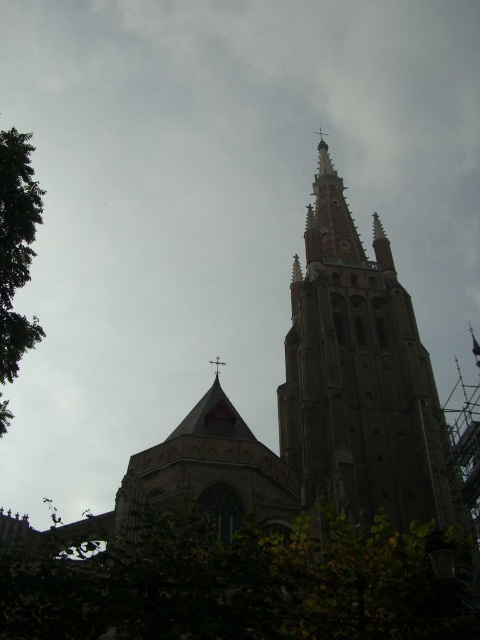
You are a landscape architect planning to install a walkway between the green leafy tree at lower center and the green leafy tree at left. What is the minimum length of the walkway required to connect both trees?

The minimum length of the walkway required to connect the green leafy tree at lower center and the green leafy tree at left is 78.92 feet, as they are 78.92 feet apart from each other.

You are standing in front of the Gothic church and notice two green leafy trees. Which tree, the green leafy tree at lower center or the green leafy tree at left, is located to the right of the other?

The green leafy tree at lower center is positioned on the right side of the green leafy tree at left.

You are standing at the entrance of the grand Gothic church and want to locate the bell tower. According to the image, where exactly is the brown stone tower at center located in terms of coordinates?

The brown stone tower at center is located at coordinates point (360, 378).